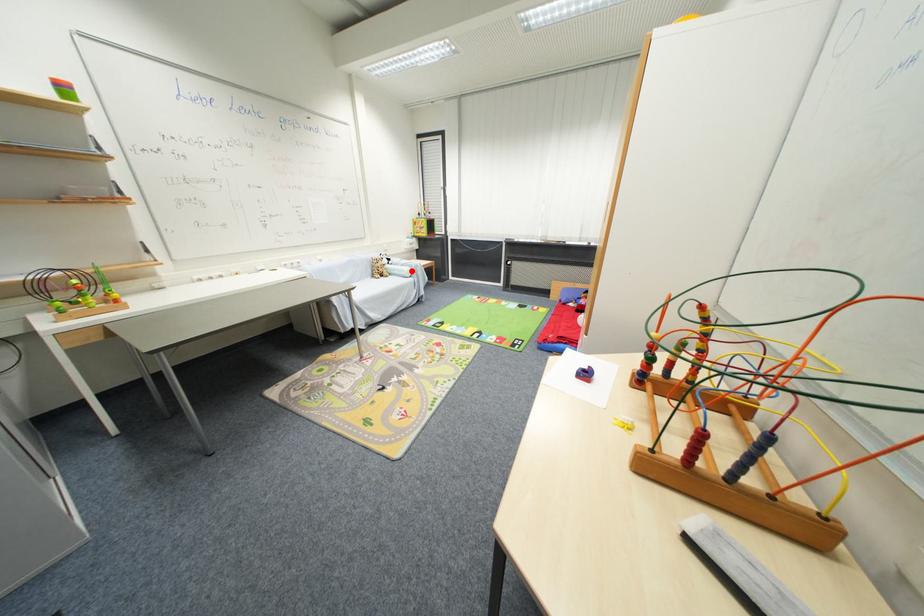
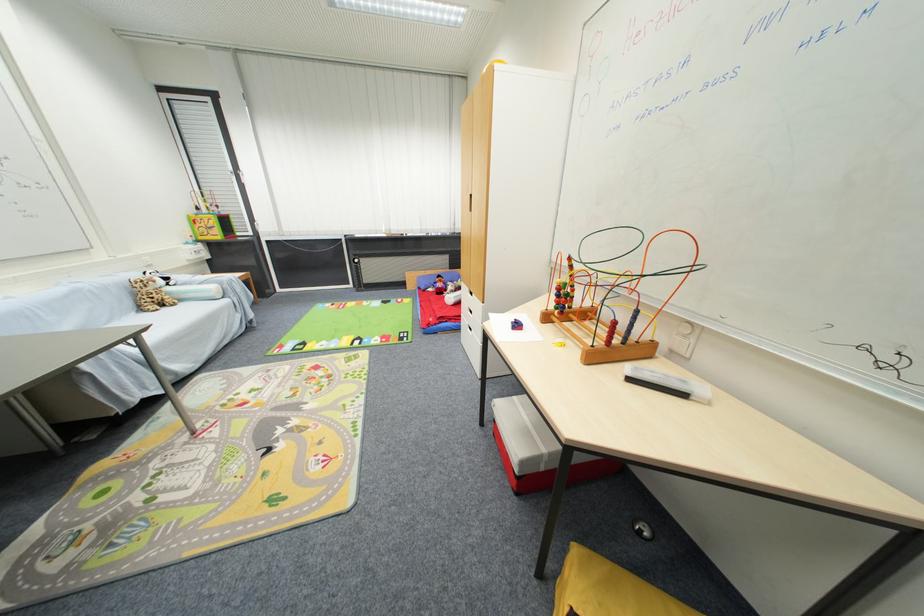
Question: I am providing you with two images of the same scene from different viewpoints. In image1, a red point is highlighted. Considering the same 3D point in image2, which of the following is correct?

Choices:
 (A) It is closer
 (B) It is farther

Answer: (B)